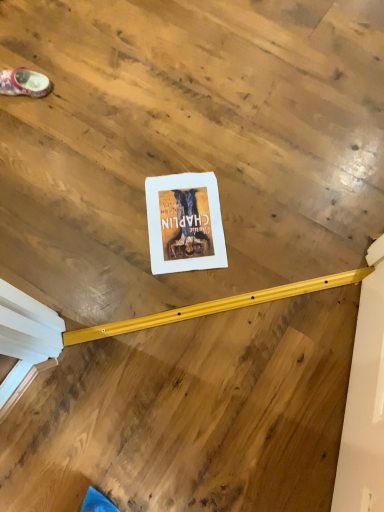
Locate an element on the screen. Image resolution: width=384 pixels, height=512 pixels. free point to the right of matte pink fabric slipper at upper left is located at coordinates (80, 86).